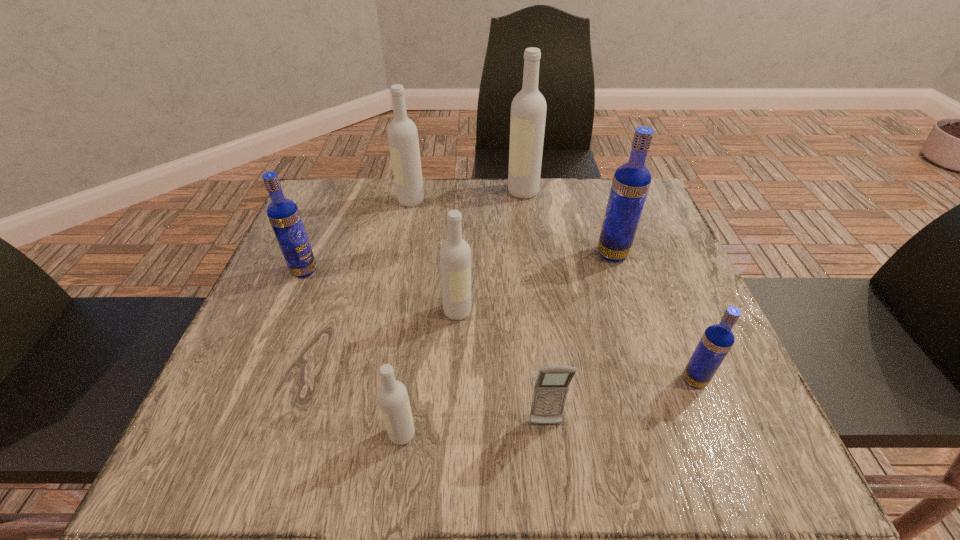
You are a GUI agent. You are given a task and a screenshot of the screen. Output one action in this format:
    pyautogui.click(x=<x>, y=<y>)
    Task: Click on the rightmost blue vodka
    This screenshot has height=540, width=960.
    Given the screenshot: What is the action you would take?
    pyautogui.click(x=715, y=343)

The image size is (960, 540). Identify the location of the rightmost vodka. (715, 343).

Image resolution: width=960 pixels, height=540 pixels. I want to click on the nearest white vodka, so click(x=392, y=396).

Where is `the nearest vodka`? The image size is (960, 540). the nearest vodka is located at coordinates 392,396.

The width and height of the screenshot is (960, 540). Identify the location of cellular telephone. (551, 387).

This screenshot has height=540, width=960. Identify the location of vacant space positioned 0.370m on the front of the tallest object. (537, 304).

At what (x,y) coordinates should I click in order to perform the action: click on vacant space located 0.070m on the right of the second object from left to right. Please return your answer as a coordinate pair (x, y). The height and width of the screenshot is (540, 960). Looking at the image, I should click on (451, 201).

Locate an element on the screen. free space located 0.220m on the front of the biggest blue vodka is located at coordinates (641, 344).

Identify the location of free space located on the right of the leftmost object. (472, 271).

At what (x,y) coordinates should I click in order to perform the action: click on blank space located on the right of the fourth object from left to right. Please return your answer as a coordinate pair (x, y). The width and height of the screenshot is (960, 540). Looking at the image, I should click on (557, 311).